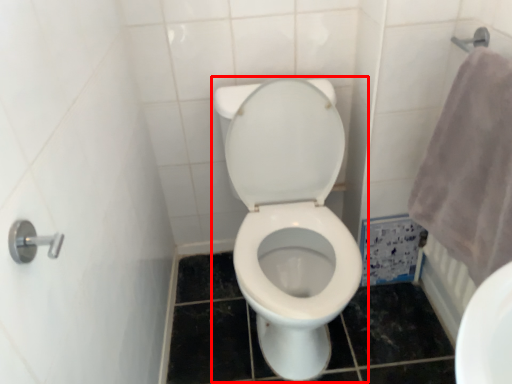
Question: From the image's perspective, where is toilet (annotated by the red box) located relative to bath towel?

Choices:
 (A) above
 (B) below

Answer: (B)